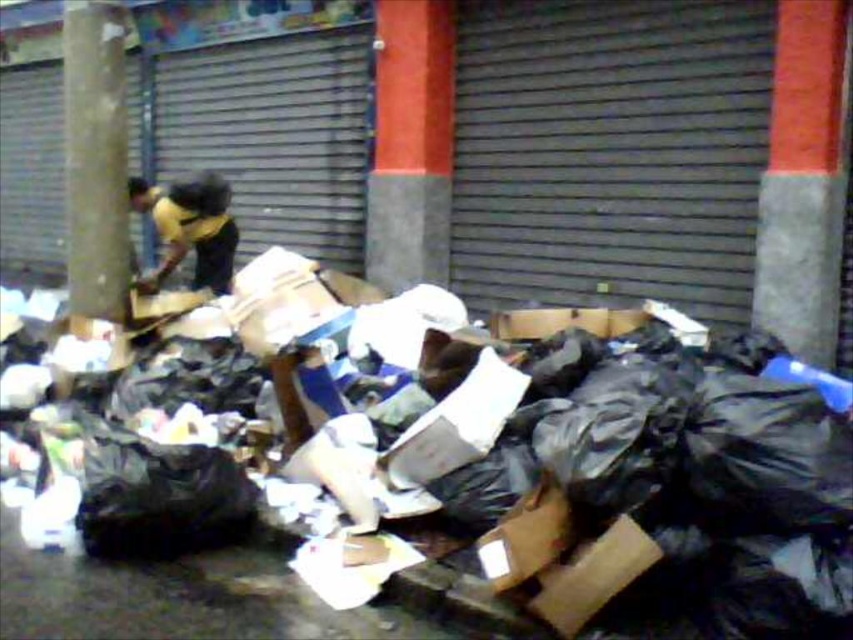
You are a delivery person who needs to pass through the area between the red concrete pillar at center and the yellow jersey at center. Can you walk through the space between them?

The red concrete pillar at center is positioned on the right side of yellow jersey at center, so there is space between them for you to walk through.

You are a waste collector trying to navigate through the garbage pile. You see the black plastic bags at center and the red concrete pillar at center right. Which object is wider from your perspective?

The black plastic bags at center might be wider than red concrete pillar at center right according to the description.